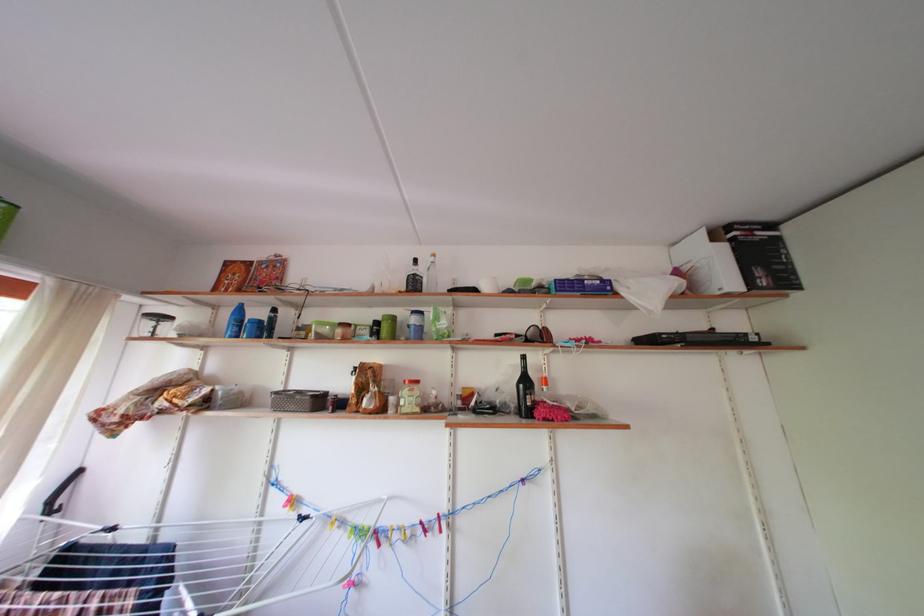
Image resolution: width=924 pixels, height=616 pixels. Describe the element at coordinates (410, 381) in the screenshot. I see `the red jar lid` at that location.